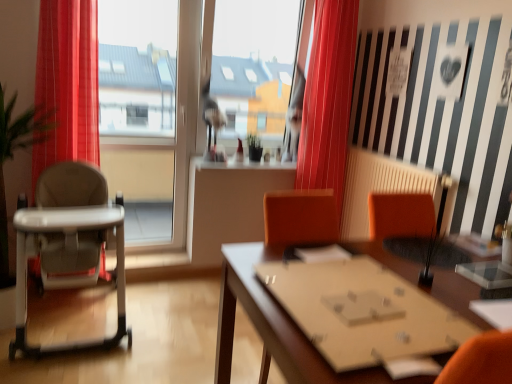
Question: From a real-world perspective, is beige radiator at center physically located above or below white plastic highchair at left?

Choices:
 (A) above
 (B) below

Answer: (A)

Question: In the image, is beige radiator at center on the left side or the right side of white plastic highchair at left?

Choices:
 (A) right
 (B) left

Answer: (A)

Question: Estimate the real-world distances between objects in this image. Which object is closer to the wooden table at center?

Choices:
 (A) beige radiator at center
 (B) white plastic highchair at left
 (C) transparent glass window at center
 (D) red velvet curtain at center

Answer: (B)

Question: Estimate the real-world distances between objects in this image. Which object is farther from the red velvet curtain at center?

Choices:
 (A) white plastic highchair at left
 (B) beige radiator at center
 (C) transparent glass window at center
 (D) wooden table at center

Answer: (A)